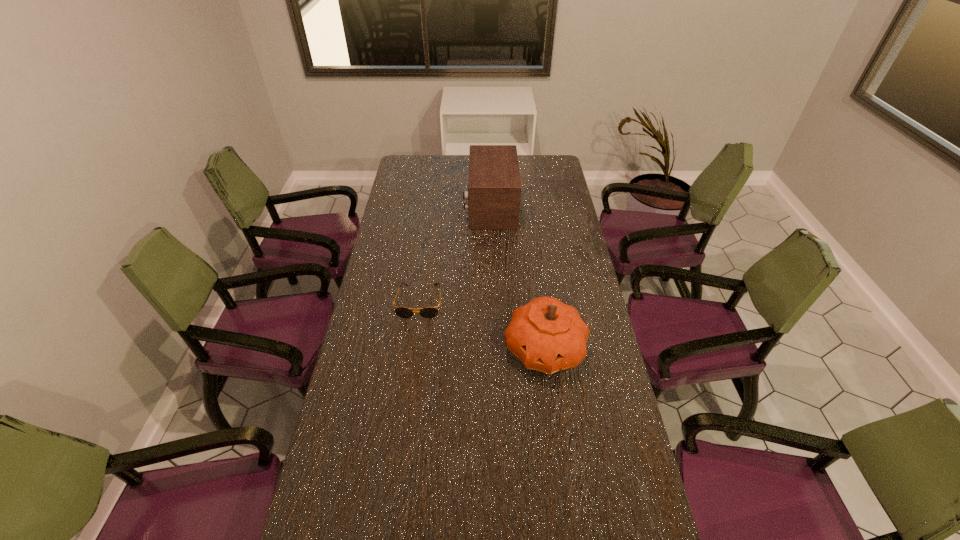
Where is `the farthest object`? the farthest object is located at coordinates (494, 187).

Locate an element on the screen. Image resolution: width=960 pixels, height=540 pixels. pumpkin is located at coordinates (547, 335).

The height and width of the screenshot is (540, 960). I want to click on the leftmost object, so click(x=428, y=312).

Identify the location of sunglasses. The height and width of the screenshot is (540, 960). (428, 312).

Where is `vacant space located on the front-facing side of the radio receiver`? This screenshot has width=960, height=540. vacant space located on the front-facing side of the radio receiver is located at coordinates (444, 206).

In order to click on vacant region located 0.060m on the front-facing side of the radio receiver in this screenshot , I will do `click(451, 206)`.

At what (x,y) coordinates should I click in order to perform the action: click on vacant point located on the front-facing side of the radio receiver. Please return your answer as a coordinate pair (x, y). This screenshot has width=960, height=540. Looking at the image, I should click on (405, 206).

Locate an element on the screen. The width and height of the screenshot is (960, 540). vacant point located 0.310m on the front-facing side of the pumpkin is located at coordinates (563, 493).

I want to click on free space located on the front-facing side of the leftmost object, so click(413, 350).

You are a GUI agent. You are given a task and a screenshot of the screen. Output one action in this format:
    pyautogui.click(x=<x>, y=<y>)
    Task: Click on the object situated at the left edge
    
    Given the screenshot: What is the action you would take?
    pyautogui.click(x=428, y=312)